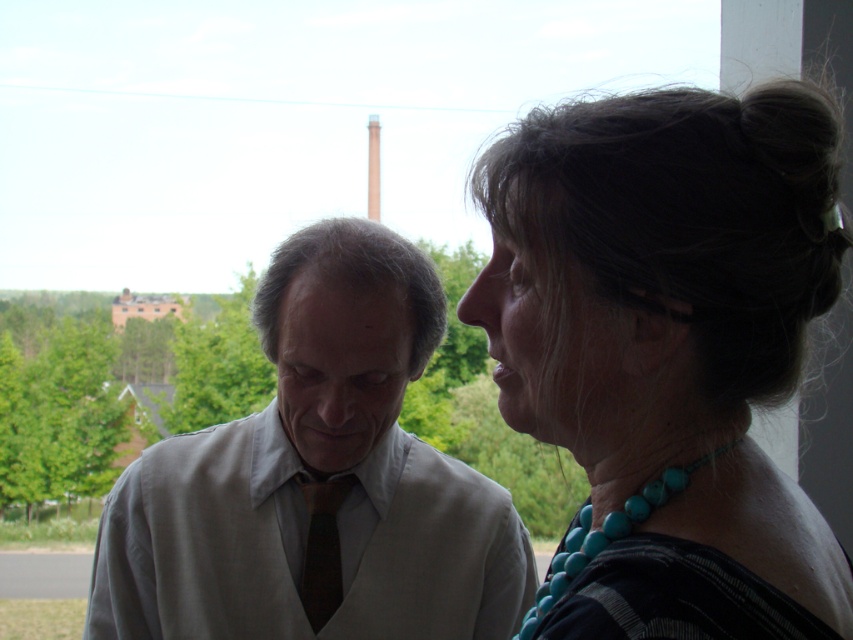
In the scene shown: You are a photographer adjusting the camera focus. You need to ensure both the turquoise beaded necklace at upper right and the light beige fabric shirt at center are in focus. Which object should you focus on first to capture both in the same frame?

You should focus on the light beige fabric shirt at center first because the turquoise beaded necklace at upper right is above it, so adjusting focus from the shirt upward will ensure both are in the frame.

You are an artist sketching the scene and need to place the turquoise beaded necklace at upper right accurately. According to the coordinates provided, where should you position it on your drawing canvas?

The turquoise beaded necklace at upper right should be positioned at coordinates point (670, 348) on the canvas.

You are a photographer trying to focus on the turquoise beaded necklace at upper right and the dark brown silk tie at center. Which object is closer to the camera?

The turquoise beaded necklace at upper right is closer to the camera than the dark brown silk tie at center because it is in front of it.